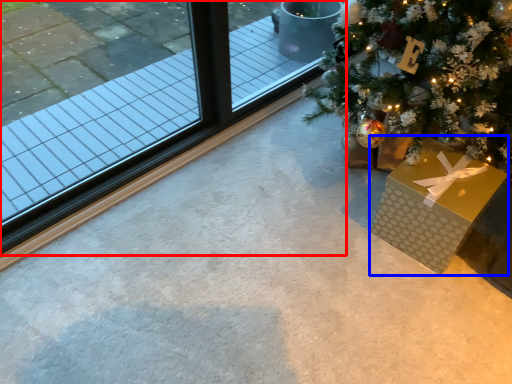
Question: Which of the following is the closest to the observer, window (highlighted by a red box) or gift box (highlighted by a blue box)?

Choices:
 (A) window
 (B) gift box

Answer: (A)